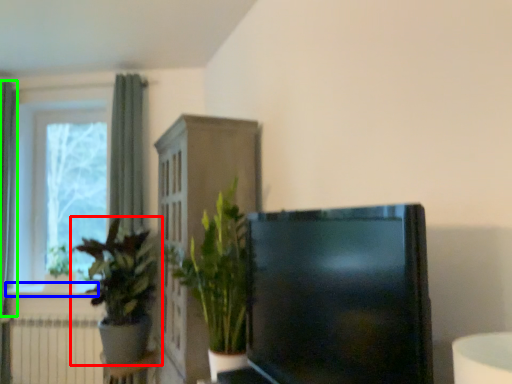
Question: Which is farther away from houseplant (highlighted by a red box)? window sill (highlighted by a blue box) or curtain (highlighted by a green box)?

Choices:
 (A) window sill
 (B) curtain

Answer: (B)